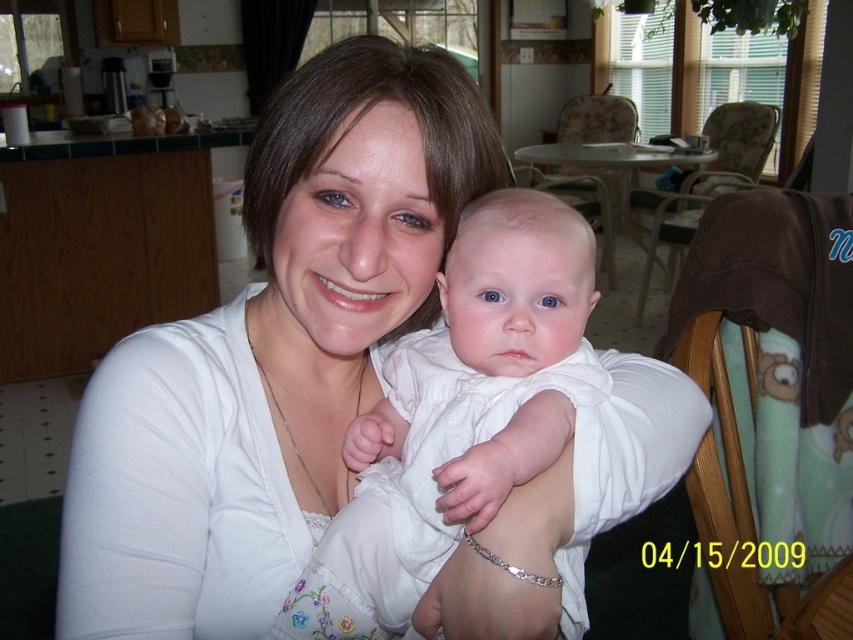
Does white satin dress at center have a larger size compared to brown fleece blanket at right?

Incorrect, white satin dress at center is not larger than brown fleece blanket at right.

Does white satin dress at center come behind brown fleece blanket at right?

No, white satin dress at center is closer to the viewer.

At what (x,y) coordinates should I click in order to perform the action: click on white satin dress at center. Please return your answer as a coordinate pair (x, y). The height and width of the screenshot is (640, 853). Looking at the image, I should click on (457, 416).

Which is more to the left, white satin dress at center or brown fabric chair at center?

Positioned to the left is white satin dress at center.

Between white satin dress at center and brown fabric chair at center, which one is positioned lower?

Positioned lower is white satin dress at center.

I want to click on white satin dress at center, so click(457, 416).

Consider the image. Is white fabric at center above wooden chair at center?

No, white fabric at center is not above wooden chair at center.

Which is in front, point (120, 516) or point (566, 177)?

Point (120, 516) is in front.

This screenshot has width=853, height=640. I want to click on white fabric at center, so click(271, 353).